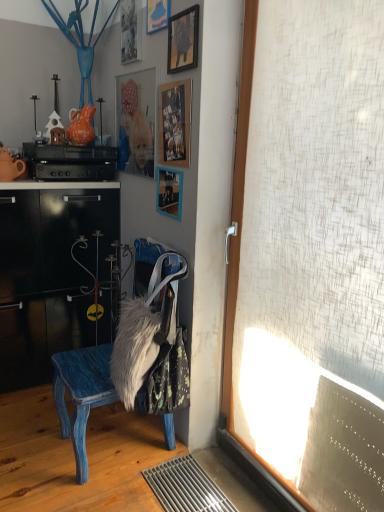
Question: In the image, is matte blue picture frame at upper center, the 1th picture frame from the top, positioned in front of or behind metallic silver picture frame at upper center, the second picture frame when ordered from top to bottom?

Choices:
 (A) behind
 (B) front

Answer: (B)

Question: In terms of width, does matte blue picture frame at upper center, placed as the 5th picture frame when sorted from bottom to top, look wider or thinner when compared to metallic silver picture frame at upper center, marked as the 4th picture frame in a bottom-to-top arrangement?

Choices:
 (A) thin
 (B) wide

Answer: (A)

Question: Considering the real-world distances, which object is closest to the wooden picture frame at upper center, positioned as the third picture frame in bottom-to-top order?

Choices:
 (A) matte blue picture frame at upper center, the 1th picture frame from the top
 (B) matte orange teapot at left, which appears as the 2th teapot when viewed from the top
 (C) black matte stereo at upper left
 (D) fuzzy fabric bag at lower center
 (E) wooden photo frame at upper center, which is the second picture frame from bottom to top

Answer: (A)

Question: Considering the real-world distances, which object is farthest from the wooden photo frame at upper center, which is the second picture frame from bottom to top?

Choices:
 (A) blue painted wood chair at center
 (B) matte blue picture frame at upper center, the 1th picture frame from the top
 (C) fuzzy fabric bag at lower center
 (D) matte orange teapot at left, which ranks as the 2th teapot in right-to-left order
 (E) wooden picture frame at upper center, arranged as the 3th picture frame when viewed from the top

Answer: (A)